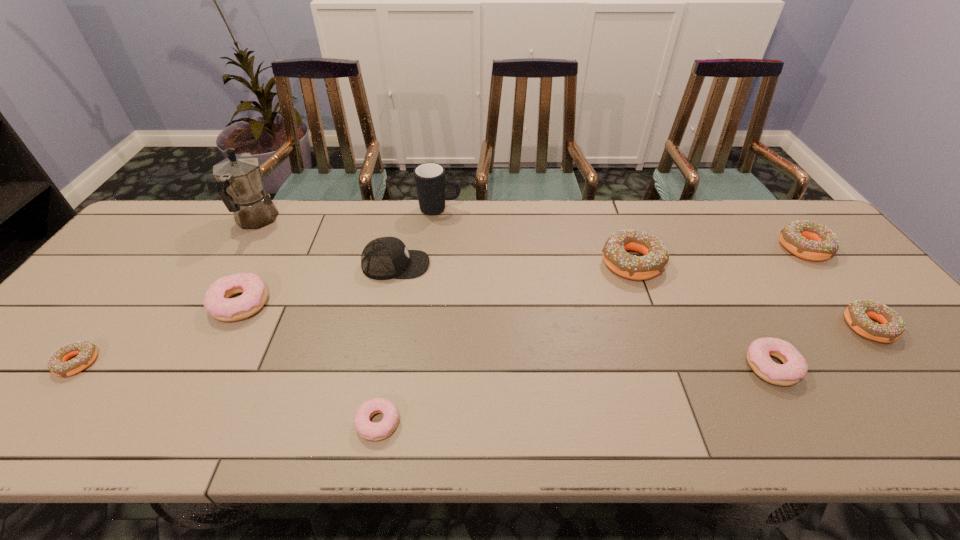
I want to click on vacant area at the near edge, so click(458, 414).

You are a GUI agent. You are given a task and a screenshot of the screen. Output one action in this format:
    pyautogui.click(x=<x>, y=<y>)
    Task: Click on the vacant space at the left edge of the desktop
    
    Given the screenshot: What is the action you would take?
    pyautogui.click(x=144, y=280)

The image size is (960, 540). I want to click on free space at the right edge of the desktop, so click(x=891, y=363).

You are a GUI agent. You are given a task and a screenshot of the screen. Output one action in this format:
    pyautogui.click(x=<x>, y=<y>)
    Task: Click on the vacant space at the far left corner of the desktop
    The image size is (960, 540).
    Given the screenshot: What is the action you would take?
    pyautogui.click(x=202, y=222)

Image resolution: width=960 pixels, height=540 pixels. Find the location of `free region at the near right corner of the desktop`. free region at the near right corner of the desktop is located at coordinates (947, 424).

At what (x,y) coordinates should I click in order to perform the action: click on vacant area that lies between the third tallest object and the tallest object. Please return your answer as a coordinate pair (x, y). The width and height of the screenshot is (960, 540). Looking at the image, I should click on (325, 242).

I want to click on free spot between the second biggest chocolate doughnut and the leftmost chocolate doughnut, so click(441, 305).

The height and width of the screenshot is (540, 960). Find the location of `free spot between the smallest chocolate doughnut and the fourth tallest object`. free spot between the smallest chocolate doughnut and the fourth tallest object is located at coordinates (354, 313).

What are the coordinates of `vacant space in between the second biggest chocolate doughnut and the eighth shortest object` in the screenshot? It's located at (600, 256).

Where is `free space between the leftmost chocolate doughnut and the third smallest chocolate doughnut`? The height and width of the screenshot is (540, 960). free space between the leftmost chocolate doughnut and the third smallest chocolate doughnut is located at coordinates 441,305.